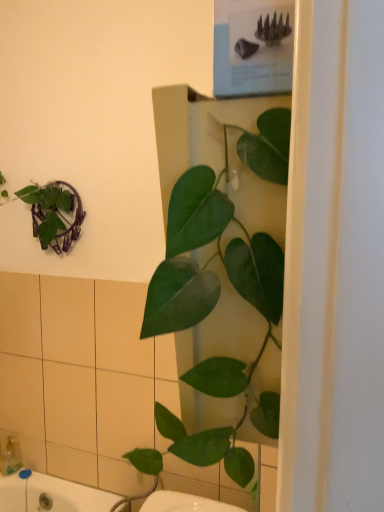
This screenshot has width=384, height=512. Find the location of `green glossy leafy plant at center`. green glossy leafy plant at center is located at coordinates (226, 284).

Image resolution: width=384 pixels, height=512 pixels. What do you see at coordinates (226, 284) in the screenshot? I see `green glossy leafy plant at center` at bounding box center [226, 284].

Image resolution: width=384 pixels, height=512 pixels. In order to click on translucent plastic soap dispenser at lower left in this screenshot , I will do pyautogui.click(x=10, y=456).

Measure the distance between point (x=10, y=459) and camera.

6.04 feet.

Measure the distance between translucent plastic soap dispenser at lower left and camera.

A distance of 1.83 meters exists between translucent plastic soap dispenser at lower left and camera.

What do you see at coordinates (10, 456) in the screenshot?
I see `translucent plastic soap dispenser at lower left` at bounding box center [10, 456].

In order to face translucent plastic soap dispenser at lower left, should I rotate leftwards or rightwards?

It's best to rotate left around 22.851 degrees.

Identify the location of green glossy leafy plant at center. The image size is (384, 512). (226, 284).

From the picture: Is green glossy leafy plant at center to the left of translucent plastic soap dispenser at lower left from the viewer's perspective?

Incorrect, green glossy leafy plant at center is not on the left side of translucent plastic soap dispenser at lower left.

Who is more distant, green glossy leafy plant at center or translucent plastic soap dispenser at lower left?

Positioned behind is translucent plastic soap dispenser at lower left.

Between point (274, 286) and point (17, 470), which one is positioned in front?

The point (274, 286) is closer to the camera.

From the image's perspective, does green glossy leafy plant at center appear lower than translucent plastic soap dispenser at lower left?

No, from the image's perspective, green glossy leafy plant at center is not below translucent plastic soap dispenser at lower left.

From a real-world perspective, between green glossy leafy plant at center and translucent plastic soap dispenser at lower left, who is vertically higher?

green glossy leafy plant at center.

Considering the relative sizes of green glossy leafy plant at center and translucent plastic soap dispenser at lower left in the image provided, is green glossy leafy plant at center thinner than translucent plastic soap dispenser at lower left?

Correct, the width of green glossy leafy plant at center is less than that of translucent plastic soap dispenser at lower left.

Is green glossy leafy plant at center shorter than translucent plastic soap dispenser at lower left?

In fact, green glossy leafy plant at center may be taller than translucent plastic soap dispenser at lower left.

Does green glossy leafy plant at center have a larger size compared to translucent plastic soap dispenser at lower left?

Yes, green glossy leafy plant at center is bigger than translucent plastic soap dispenser at lower left.

Is green glossy leafy plant at center spatially inside translucent plastic soap dispenser at lower left, or outside of it?

green glossy leafy plant at center lies outside translucent plastic soap dispenser at lower left.

Is green glossy leafy plant at center not close to translucent plastic soap dispenser at lower left?

Absolutely, green glossy leafy plant at center is distant from translucent plastic soap dispenser at lower left.

Consider the image. Does green glossy leafy plant at center turn towards translucent plastic soap dispenser at lower left?

No, green glossy leafy plant at center does not turn towards translucent plastic soap dispenser at lower left.

What's the angular difference between green glossy leafy plant at center and translucent plastic soap dispenser at lower left's facing directions?

There is a 90-degree angle between the facing directions of green glossy leafy plant at center and translucent plastic soap dispenser at lower left.

Measure the distance between green glossy leafy plant at center and translucent plastic soap dispenser at lower left.

green glossy leafy plant at center and translucent plastic soap dispenser at lower left are 5.75 feet apart.

The width and height of the screenshot is (384, 512). Find the location of `soap dispenser that appears on the left of green glossy leafy plant at center`. soap dispenser that appears on the left of green glossy leafy plant at center is located at coordinates (10, 456).

Is translucent plastic soap dispenser at lower left to the left or to the right of green glossy leafy plant at center in the image?

In the image, translucent plastic soap dispenser at lower left appears on the left side of green glossy leafy plant at center.

Which is behind, translucent plastic soap dispenser at lower left or green glossy leafy plant at center?

translucent plastic soap dispenser at lower left.

Which is less distant, (x=3, y=442) or (x=220, y=160)?

Clearly, point (x=3, y=442) is more distant from the camera than point (x=220, y=160).

From the image's perspective, does translucent plastic soap dispenser at lower left appear higher than green glossy leafy plant at center?

No.

From a real-world perspective, is translucent plastic soap dispenser at lower left located beneath green glossy leafy plant at center?

Yes.

Considering the sizes of translucent plastic soap dispenser at lower left and green glossy leafy plant at center in the image, is translucent plastic soap dispenser at lower left wider or thinner than green glossy leafy plant at center?

Considering their sizes, translucent plastic soap dispenser at lower left looks broader than green glossy leafy plant at center.

Considering the sizes of objects translucent plastic soap dispenser at lower left and green glossy leafy plant at center in the image provided, who is shorter, translucent plastic soap dispenser at lower left or green glossy leafy plant at center?

translucent plastic soap dispenser at lower left is shorter.

In the scene shown: Considering the sizes of objects translucent plastic soap dispenser at lower left and green glossy leafy plant at center in the image provided, who is bigger, translucent plastic soap dispenser at lower left or green glossy leafy plant at center?

green glossy leafy plant at center is bigger.

In the scene shown: Is translucent plastic soap dispenser at lower left outside of green glossy leafy plant at center?

Yes, translucent plastic soap dispenser at lower left is located beyond the bounds of green glossy leafy plant at center.

Are translucent plastic soap dispenser at lower left and green glossy leafy plant at center beside each other?

No, translucent plastic soap dispenser at lower left is not making contact with green glossy leafy plant at center.

Is translucent plastic soap dispenser at lower left facing away from green glossy leafy plant at center?

No, translucent plastic soap dispenser at lower left's orientation is not away from green glossy leafy plant at center.

Could you measure the distance between translucent plastic soap dispenser at lower left and green glossy leafy plant at center?

They are 5.75 feet apart.

The image size is (384, 512). Find the location of `houseplant on the right of translucent plastic soap dispenser at lower left`. houseplant on the right of translucent plastic soap dispenser at lower left is located at coordinates (226, 284).

This screenshot has height=512, width=384. In the image, there is a translucent plastic soap dispenser at lower left. In order to click on houseplant above it (from the image's perspective) in this screenshot , I will do click(x=226, y=284).

Identify the location of soap dispenser located underneath the green glossy leafy plant at center (from a real-world perspective). (10, 456).